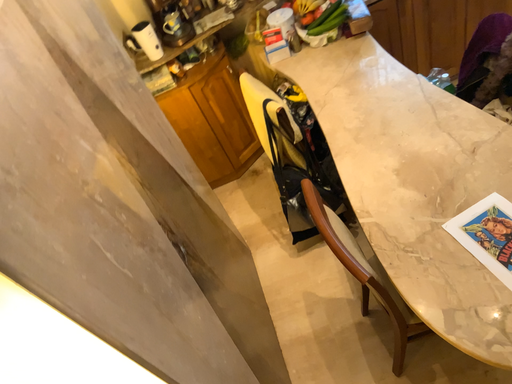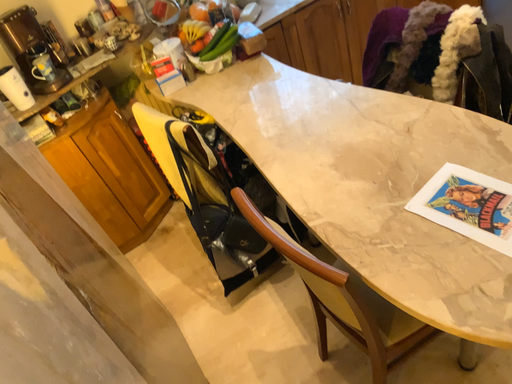
Question: How did the camera likely rotate when shooting the video?

Choices:
 (A) rotated right
 (B) rotated left

Answer: (A)